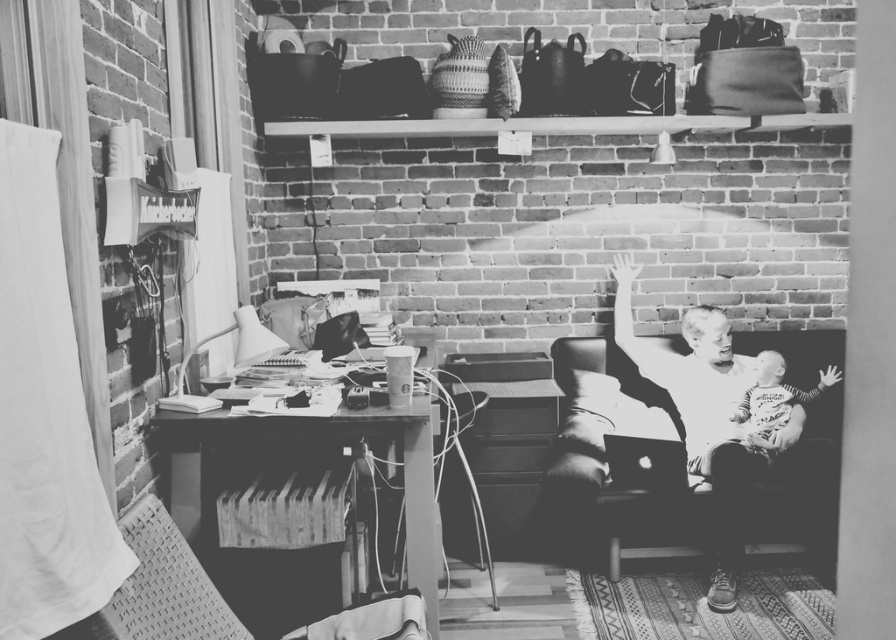
Question: In this image, where is soft leather couch at center located relative to wooden desk at left?

Choices:
 (A) above
 (B) below

Answer: (B)

Question: Can you confirm if soft leather couch at center is wider than wooden desk at left?

Choices:
 (A) no
 (B) yes

Answer: (B)

Question: Which of the following is the closest to the observer?

Choices:
 (A) soft leather couch at center
 (B) wooden desk at left

Answer: (B)

Question: Observing the image, what is the correct spatial positioning of soft leather couch at center in reference to wooden desk at left?

Choices:
 (A) right
 (B) left

Answer: (A)